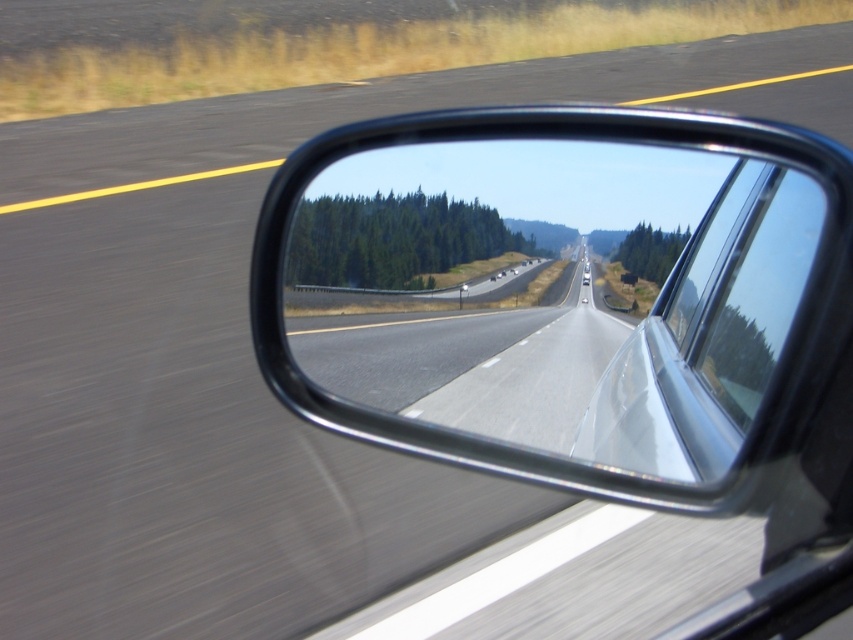
Question: Is black glossy mirror at center above transparent glass car window at center?

Choices:
 (A) no
 (B) yes

Answer: (B)

Question: Is black glossy mirror at center bigger than transparent glass car window at center?

Choices:
 (A) no
 (B) yes

Answer: (A)

Question: Is black glossy mirror at center bigger than transparent glass car window at center?

Choices:
 (A) yes
 (B) no

Answer: (B)

Question: Which of the following is the closest to the observer?

Choices:
 (A) 753,332
 (B) 683,184

Answer: (A)

Question: Which point is closer to the camera?

Choices:
 (A) transparent glass car window at center
 (B) black glossy mirror at center

Answer: (A)